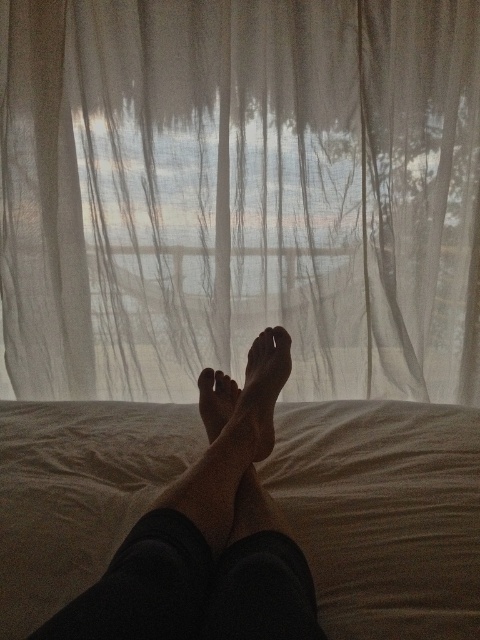
Question: Which of the following is the closest to the observer?

Choices:
 (A) skinny bare feet at center
 (B) translucent white curtain at center
 (C) smooth skin foot at center

Answer: (A)

Question: Can you confirm if translucent white curtain at center is positioned to the right of smooth skin foot at center?

Choices:
 (A) yes
 (B) no

Answer: (B)

Question: Which of the following is the farthest from the observer?

Choices:
 (A) smooth skin foot at center
 (B) translucent white curtain at center

Answer: (B)

Question: Does skinny bare feet at center appear on the right side of smooth skin foot at center?

Choices:
 (A) yes
 (B) no

Answer: (B)

Question: Which point is closer to the camera?

Choices:
 (A) (257, 516)
 (B) (277, 365)
 (C) (384, 67)

Answer: (A)

Question: Is translucent white curtain at center above skinny bare feet at center?

Choices:
 (A) no
 (B) yes

Answer: (B)